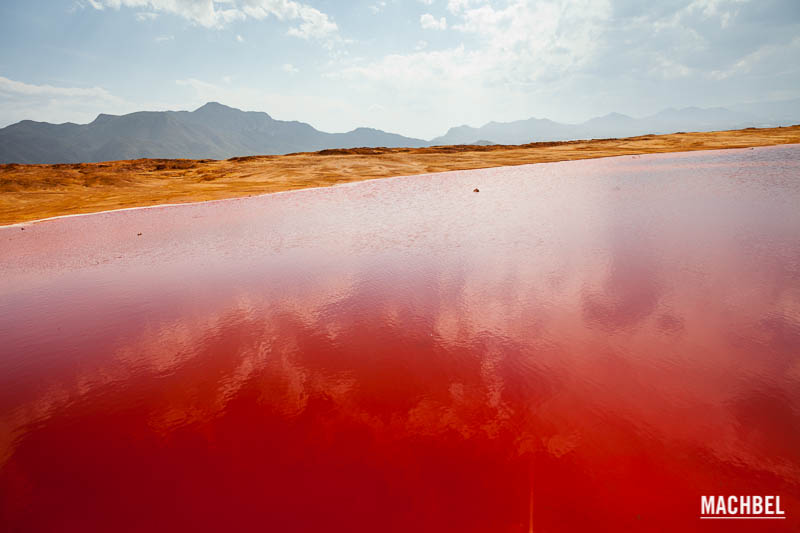
At what (x,y) coordinates should I click in order to perform the action: click on bottom left corner empty space. Please return your answer as a coordinate pair (x, y). Looking at the image, I should click on (2, 529).